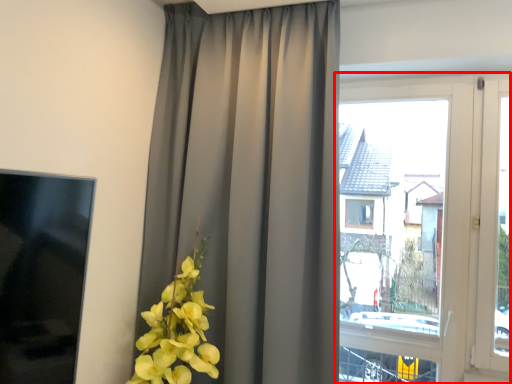
Question: From the image's perspective, where is window (annotated by the red box) located relative to curtain?

Choices:
 (A) above
 (B) below

Answer: (B)